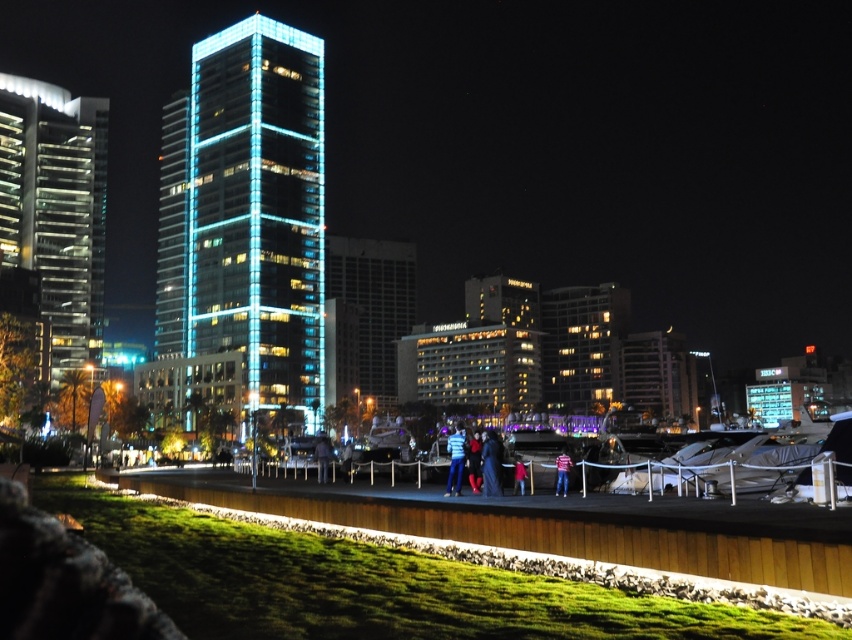
Question: Which point is farther to the camera?

Choices:
 (A) velvet black dress at center
 (B) dark blue jeans at center
 (C) blue denim jeans at center
 (D) glassy reflective skyscraper at left

Answer: (D)

Question: Which point appears closest to the camera in this image?

Choices:
 (A) (56, 189)
 (B) (325, 442)
 (C) (517, 474)

Answer: (C)

Question: Can you confirm if velvet black dress at center is positioned below pink striped shirt at center?

Choices:
 (A) no
 (B) yes

Answer: (A)

Question: Does velvet black dress at center have a greater width compared to red fabric jacket at center?

Choices:
 (A) yes
 (B) no

Answer: (A)

Question: Is glassy reflective skyscraper at left bigger than red fabric jacket at center?

Choices:
 (A) yes
 (B) no

Answer: (A)

Question: Among these objects, which one is farthest from the camera?

Choices:
 (A) blue glassy tower at center
 (B) velvet black dress at center
 (C) pink striped shirt at center

Answer: (A)